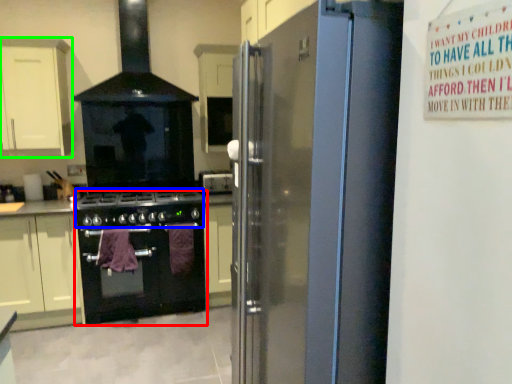
Question: Estimate the real-world distances between objects in this image. Which object is closer to kitchen appliance (highlighted by a red box), gas stove (highlighted by a blue box) or cabinetry (highlighted by a green box)?

Choices:
 (A) gas stove
 (B) cabinetry

Answer: (A)